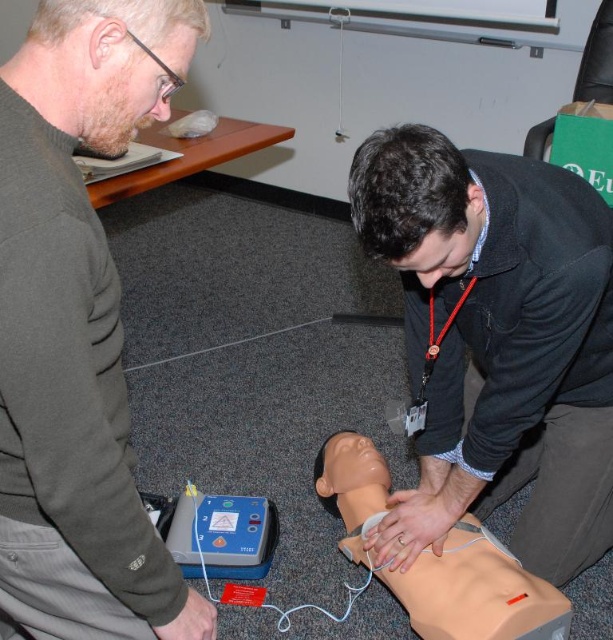
You are standing in the training room and need to locate the dark gray sweater at left. According to the coordinates provided, where exactly is it positioned?

The dark gray sweater at left is positioned at coordinates point (78, 328).

You are a first responder entering the room and see the dark gray sweater at left and the matte black jacket at lower center. Which clothing item is closer to the CPR mannequin?

The matte black jacket at lower center is closer to the CPR mannequin because it is positioned at lower center compared to the dark gray sweater at left.

You are a first responder entering the scene and need to quickly assess the situation. Which person, the one wearing the dark gray sweater at left or the matte black jacket at lower center, is closer to you?

The dark gray sweater at left is closer to the viewer than the matte black jacket at lower center, so the person wearing the dark gray sweater at left is closer to you.